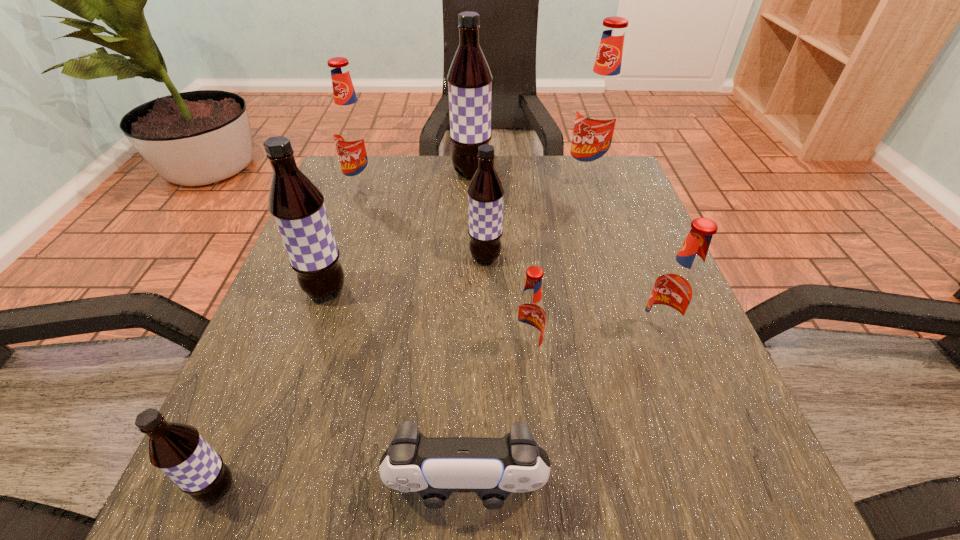
Locate an element on the screen. the biggest brown root beer is located at coordinates (469, 78).

Locate an element on the screen. the biggest red root beer is located at coordinates (598, 115).

This screenshot has height=540, width=960. What are the coordinates of `the leftmost red root beer` in the screenshot? It's located at (352, 134).

Identify the location of the fifth farthest object. The image size is (960, 540). (297, 206).

The image size is (960, 540). Find the location of `the third farthest brown root beer`. the third farthest brown root beer is located at coordinates (297, 206).

Identify the location of the third biggest red root beer. (x=677, y=290).

This screenshot has width=960, height=540. Identify the location of the second smallest brown root beer. (485, 192).

Locate an element on the screen. This screenshot has width=960, height=540. the third nearest brown root beer is located at coordinates (485, 192).

The height and width of the screenshot is (540, 960). Find the location of `the sixth root beer from left to right`. the sixth root beer from left to right is located at coordinates (529, 319).

Where is `the second red root beer from left to right`? This screenshot has height=540, width=960. the second red root beer from left to right is located at coordinates (529, 319).